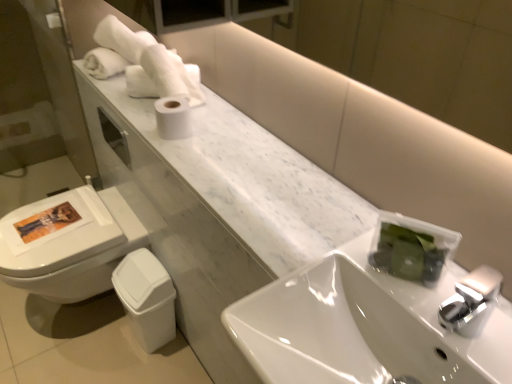
Find the location of a particular element. The height and width of the screenshot is (384, 512). vacant space in front of white soft towel at upper left is located at coordinates (111, 86).